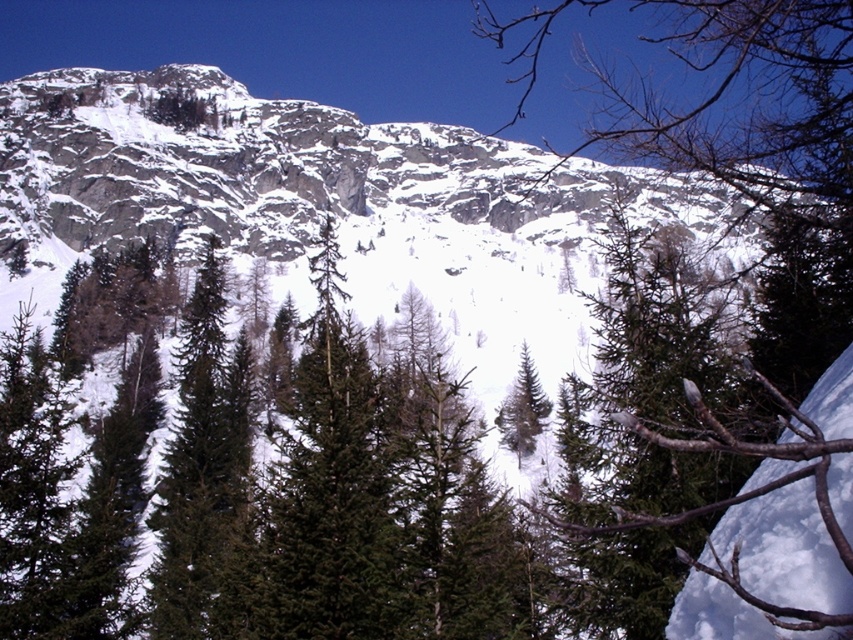
You are a photographer standing at the base of the rocky gray mountain at upper center. You want to capture a wide shot of the mountain in your camera. Given that your camera can focus on objects up to 150 meters away, will the mountain be in focus?

The rocky gray mountain at upper center is 144.49 meters from camera, which is within the camera focus range of up to 150 meters. Therefore, the mountain will be in focus.

You are standing at the point marked as point (265,164) in the winter landscape image. What major geographical feature are you currently positioned at?

The point (265,164) corresponds to the rocky gray mountain at upper center, so you are positioned at the rocky gray mountain at upper center.